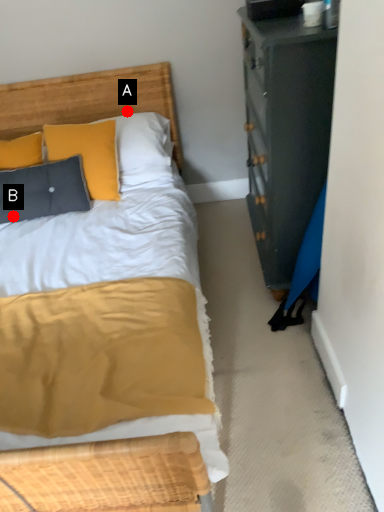
Question: Two points are circled on the image, labeled by A and B beside each circle. Among these points, which one is nearest to the camera?

Choices:
 (A) A is closer
 (B) B is closer

Answer: (B)